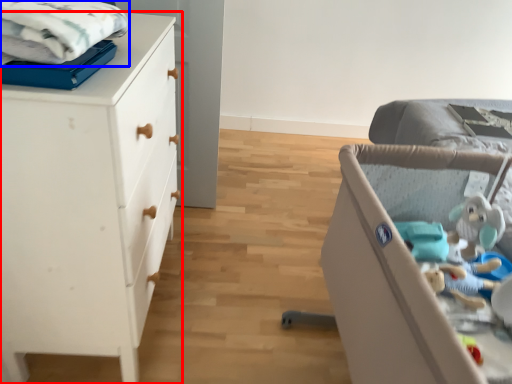
Question: Among these objects, which one is farthest to the camera, chest of drawers (highlighted by a red box) or cloth (highlighted by a blue box)?

Choices:
 (A) chest of drawers
 (B) cloth

Answer: (A)